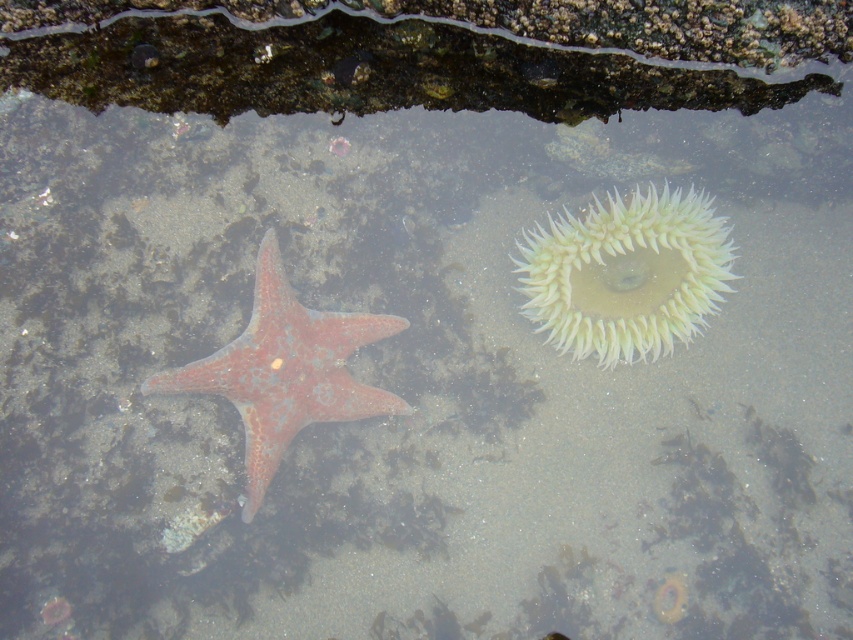
Is white spiky anemone at upper right smaller than rusty matte starfish at center?

Yes, white spiky anemone at upper right is smaller than rusty matte starfish at center.

Between white spiky anemone at upper right and rusty matte starfish at center, which one has less height?

With less height is white spiky anemone at upper right.

Locate an element on the screen. white spiky anemone at upper right is located at coordinates (625, 273).